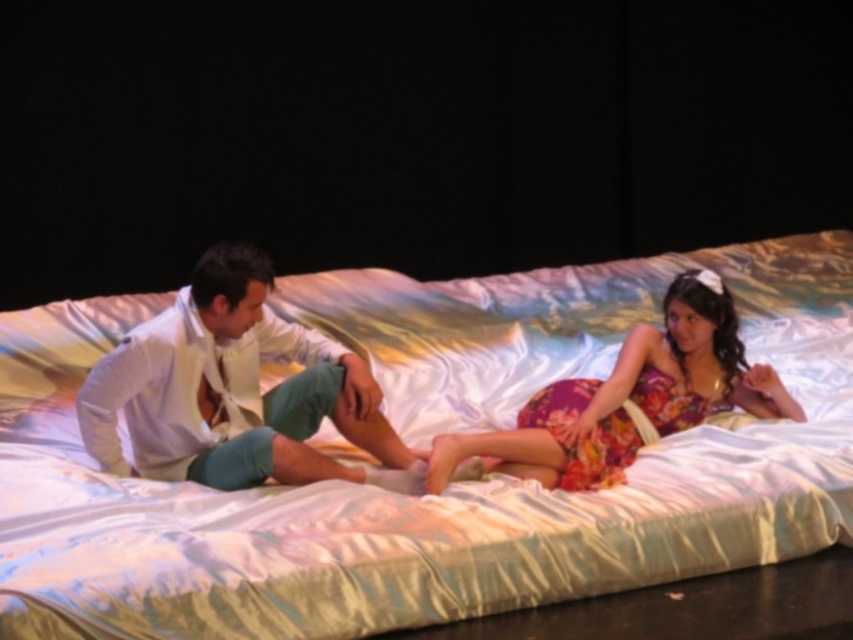
Measure the distance between point (279, 380) and camera.

The distance of point (279, 380) from camera is 4.28 meters.

Is point (757, 310) positioned after point (90, 387)?

Yes.

Identify the location of silky satin bed at center. (422, 445).

Does white satin shirt at center appear under floral fabric dress at center?

No.

Can you confirm if white satin shirt at center is positioned to the left of floral fabric dress at center?

Correct, you'll find white satin shirt at center to the left of floral fabric dress at center.

Where is `white satin shirt at center`? The image size is (853, 640). white satin shirt at center is located at coordinates tap(234, 390).

Does silky satin bed at center have a greater height compared to floral fabric dress at center?

Yes.

Between point (430, 392) and point (675, 416), which one is positioned in front?

Point (675, 416) is in front.

Where is `silky satin bed at center`? silky satin bed at center is located at coordinates (422, 445).